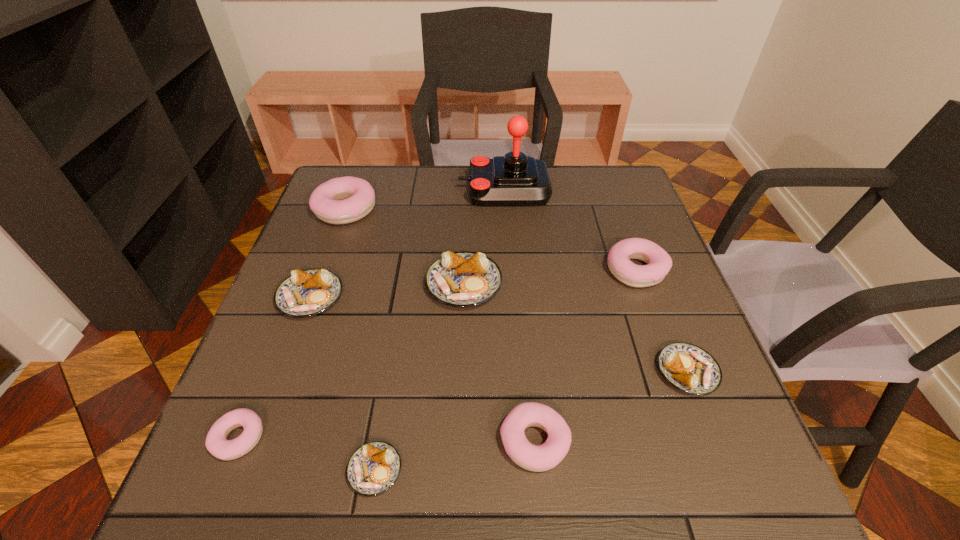
This screenshot has width=960, height=540. I want to click on vacant point at the left edge, so click(344, 234).

Locate an element on the screen. free space at the right edge of the desktop is located at coordinates (697, 421).

You are a GUI agent. You are given a task and a screenshot of the screen. Output one action in this format:
    pyautogui.click(x=<x>, y=<y>)
    Task: Click on the vacant region at the near right corner
    
    Given the screenshot: What is the action you would take?
    pyautogui.click(x=695, y=476)

Find the location of `free space that is in between the joystick and the nearest brown pastry`. free space that is in between the joystick and the nearest brown pastry is located at coordinates (440, 330).

The height and width of the screenshot is (540, 960). What are the coordinates of `free point between the sixth farthest object and the biggest brown pastry` in the screenshot? It's located at (575, 328).

Where is `free space between the third biggest pink pastry and the leftmost brown pastry`? free space between the third biggest pink pastry and the leftmost brown pastry is located at coordinates (422, 369).

Identify the location of vacant area that lies between the second biggest pink pastry and the nearest brown pastry. (506, 370).

The height and width of the screenshot is (540, 960). What are the coordinates of `vacant point located between the fifth farthest pastry and the second brown pastry from right to left` in the screenshot? It's located at (575, 328).

In order to click on vacant area between the smallest pink pastry and the joystick in this screenshot , I will do `click(372, 314)`.

Locate an element on the screen. The image size is (960, 540). free area in between the second smallest pink pastry and the third brown pastry from left to right is located at coordinates (499, 363).